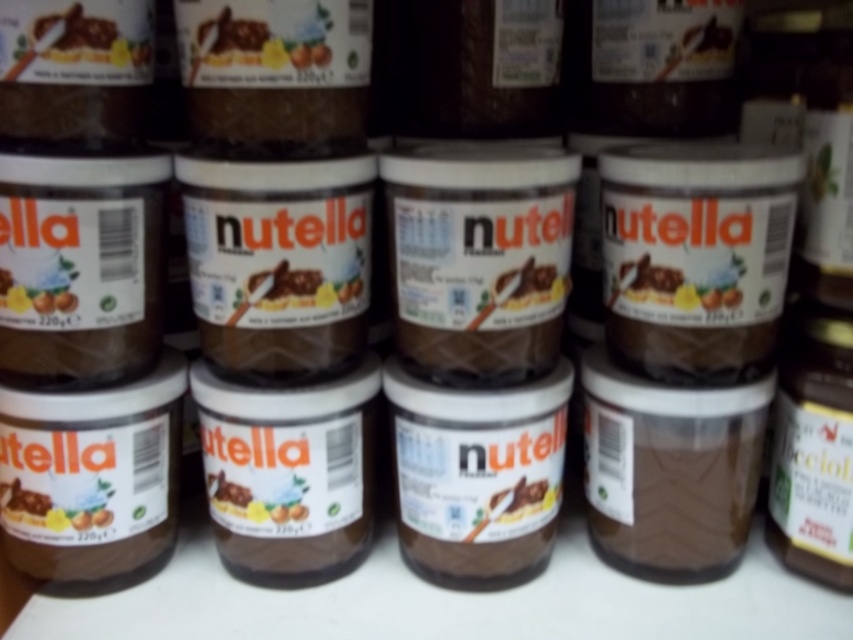
Consider the image. You are organizing a pantry and see the matte chocolate spread at center and the matte brown jar at left on the shelf. Which one is closer to you?

The matte chocolate spread at center is closer to you because the matte brown jar at left is behind it.

You are organizing the Nutella jars on a shelf. You need to ensure that the jar at the center is placed above the jar on the left. Currently, how is the arrangement of the matte brown jar at center and the matte brown jar at left? Is it correct?

The matte brown jar at center is located below the matte brown jar at left, so the current arrangement is incorrect because the jar at the center should be placed above the one on the left.

From the picture: You are a delivery person who needs to place a new jar of matte chocolate spread at center on the shelf. The shelf has a coordinate system where the bottom left corner is the origin. Where should you place the new jar?

Place the new jar of matte chocolate spread at center at the coordinate point (x=677, y=285).